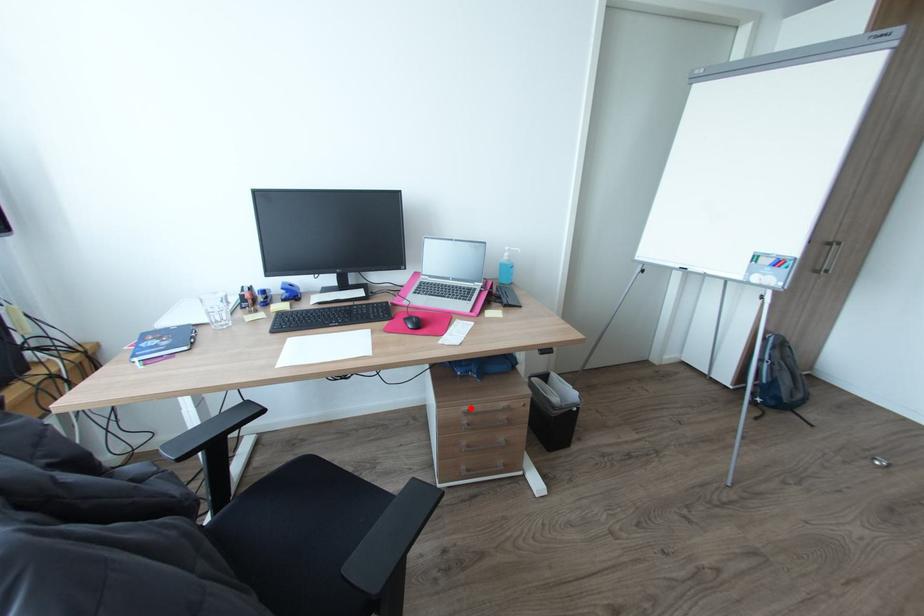
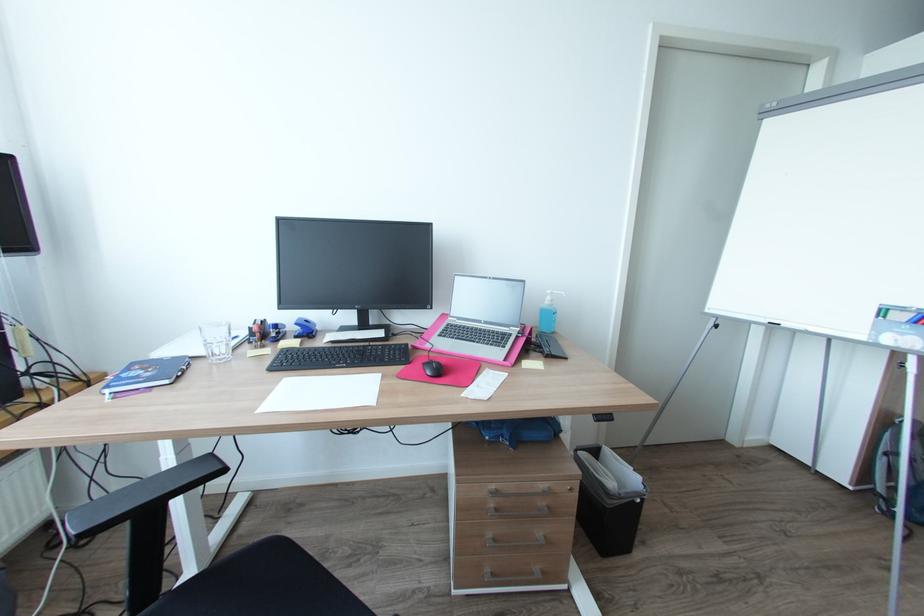
Find the pixel in the second image that matches the highlighted location in the first image.

(497, 487)